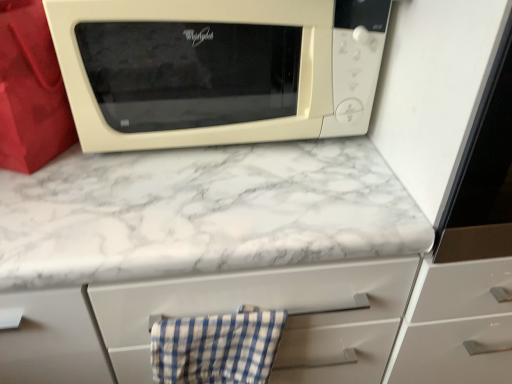
Question: Is beige matte microwave at upper center not inside blue checkered cloth at lower center?

Choices:
 (A) yes
 (B) no

Answer: (A)

Question: Is beige matte microwave at upper center at the right side of blue checkered cloth at lower center?

Choices:
 (A) yes
 (B) no

Answer: (A)

Question: From the image's perspective, does beige matte microwave at upper center appear lower than blue checkered cloth at lower center?

Choices:
 (A) no
 (B) yes

Answer: (A)

Question: From a real-world perspective, is beige matte microwave at upper center positioned under blue checkered cloth at lower center based on gravity?

Choices:
 (A) no
 (B) yes

Answer: (A)

Question: Can you confirm if beige matte microwave at upper center is wider than blue checkered cloth at lower center?

Choices:
 (A) no
 (B) yes

Answer: (B)

Question: Is beige matte microwave at upper center taller or shorter than blue checkered cloth at lower center?

Choices:
 (A) short
 (B) tall

Answer: (B)

Question: Is beige matte microwave at upper center wider or thinner than blue checkered cloth at lower center?

Choices:
 (A) wide
 (B) thin

Answer: (A)

Question: From a real-world perspective, relative to blue checkered cloth at lower center, is beige matte microwave at upper center vertically above or below?

Choices:
 (A) below
 (B) above

Answer: (B)

Question: Do you think beige matte microwave at upper center is within blue checkered cloth at lower center, or outside of it?

Choices:
 (A) inside
 (B) outside

Answer: (B)

Question: From the image's perspective, is blue checkered cloth at lower center positioned above or below beige matte microwave at upper center?

Choices:
 (A) below
 (B) above

Answer: (A)

Question: Does point (214, 365) appear closer or farther from the camera than point (222, 140)?

Choices:
 (A) closer
 (B) farther

Answer: (A)

Question: Considering the positions of blue checkered cloth at lower center and beige matte microwave at upper center in the image, is blue checkered cloth at lower center taller or shorter than beige matte microwave at upper center?

Choices:
 (A) short
 (B) tall

Answer: (A)

Question: Is blue checkered cloth at lower center spatially inside beige matte microwave at upper center, or outside of it?

Choices:
 (A) inside
 (B) outside

Answer: (B)

Question: Would you say white marble countertop at upper center is to the left or to the right of blue checkered cloth at lower center in the picture?

Choices:
 (A) left
 (B) right

Answer: (A)

Question: From their relative heights in the image, would you say white marble countertop at upper center is taller or shorter than blue checkered cloth at lower center?

Choices:
 (A) tall
 (B) short

Answer: (A)